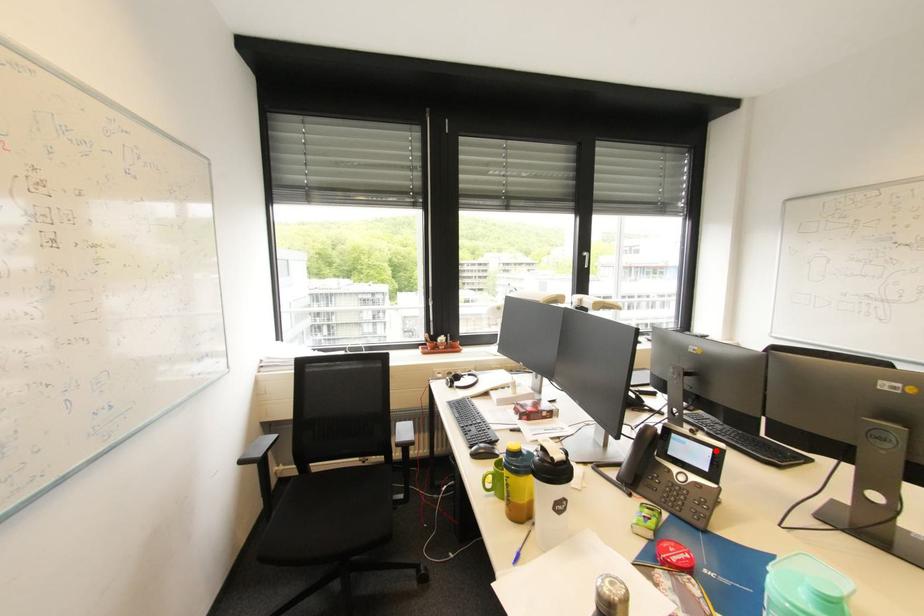
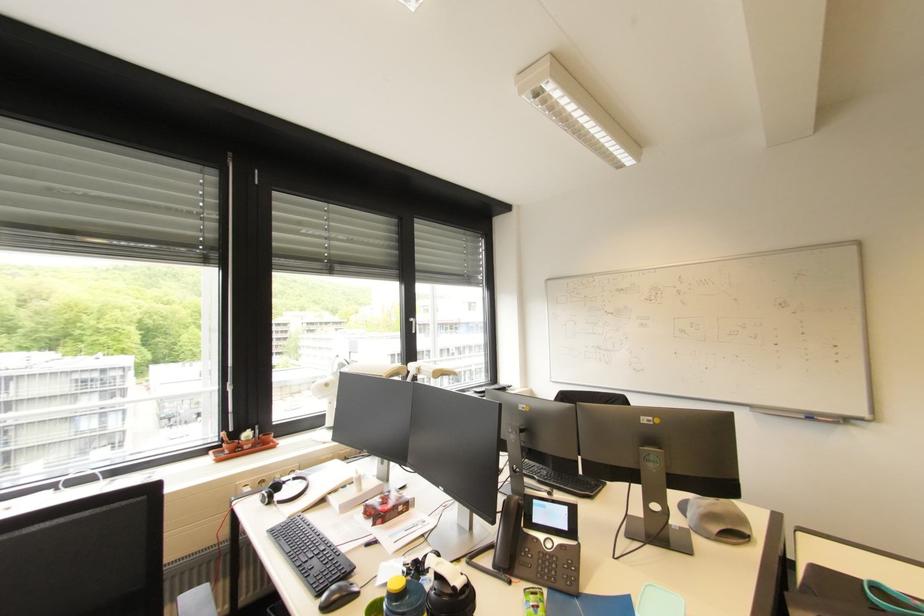
Find the pixel in the second image that matches the highlighted location in the first image.

(572, 509)